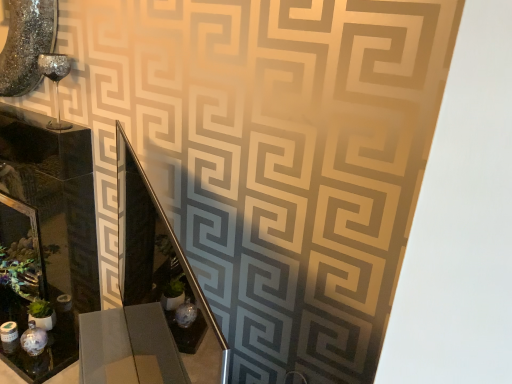
At what (x,y) coordinates should I click in order to perform the action: click on matte black glass box at left. Please return your answer as a coordinate pair (x, y). The width and height of the screenshot is (512, 384). Looking at the image, I should click on (47, 234).

Where is `matte glass picture frame at lower left`? The height and width of the screenshot is (384, 512). matte glass picture frame at lower left is located at coordinates (32, 236).

Is metallic silver vanity at center taller than matte glass picture frame at lower left?

Indeed, metallic silver vanity at center has a greater height compared to matte glass picture frame at lower left.

From the picture: Can you confirm if metallic silver vanity at center is positioned to the right of matte glass picture frame at lower left?

Yes, metallic silver vanity at center is to the right of matte glass picture frame at lower left.

Can you confirm if metallic silver vanity at center is wider than matte glass picture frame at lower left?

Incorrect, the width of metallic silver vanity at center does not surpass that of matte glass picture frame at lower left.

From the picture: Is metallic silver vanity at center completely or partially outside of matte glass picture frame at lower left?

Yes, metallic silver vanity at center is not within matte glass picture frame at lower left.

Would you say metallic silver vanity at center is part of matte black glass box at left's contents?

That's incorrect, metallic silver vanity at center is not inside matte black glass box at left.

Is matte black glass box at left wider or thinner than metallic silver vanity at center?

Considering their sizes, matte black glass box at left looks broader than metallic silver vanity at center.

Between point (47, 216) and point (126, 248), which one is positioned in front?

The point (126, 248) is in front.

Is matte black glass box at left aimed at metallic silver vanity at center?

No.

Between matte glass picture frame at lower left and metallic silver vanity at center, which one has less height?

matte glass picture frame at lower left is shorter.

Is matte glass picture frame at lower left looking in the opposite direction of metallic silver vanity at center?

No.

Where is `vanity that is in front of the matte glass picture frame at lower left`? Image resolution: width=512 pixels, height=384 pixels. vanity that is in front of the matte glass picture frame at lower left is located at coordinates (149, 299).

Is matte black glass box at left in front of or behind matte glass picture frame at lower left in the image?

matte black glass box at left is in front of matte glass picture frame at lower left.

Can we say matte black glass box at left lies outside matte glass picture frame at lower left?

That's correct, matte black glass box at left is outside of matte glass picture frame at lower left.

In the scene shown: Considering the relative sizes of matte black glass box at left and matte glass picture frame at lower left in the image provided, is matte black glass box at left wider than matte glass picture frame at lower left?

Correct, the width of matte black glass box at left exceeds that of matte glass picture frame at lower left.

Considering the points (33, 275) and (12, 200), which point is in front, point (33, 275) or point (12, 200)?

The point (12, 200) is closer to the camera.

In the image, is metallic silver vanity at center on the left side or the right side of matte black glass box at left?

Clearly, metallic silver vanity at center is on the right of matte black glass box at left in the image.

Which of these two, metallic silver vanity at center or matte black glass box at left, is bigger?

matte black glass box at left.

Is metallic silver vanity at center further to camera compared to matte black glass box at left?

No, metallic silver vanity at center is in front of matte black glass box at left.

Is metallic silver vanity at center positioned far away from matte black glass box at left?

No, there isn't a large distance between metallic silver vanity at center and matte black glass box at left.

Is matte glass picture frame at lower left to the left or to the right of matte black glass box at left in the image?

Based on their positions, matte glass picture frame at lower left is located to the left of matte black glass box at left.

How distant is matte glass picture frame at lower left from matte black glass box at left?

matte glass picture frame at lower left is 9.71 inches from matte black glass box at left.

From a real-world perspective, is matte glass picture frame at lower left located higher than matte black glass box at left?

Incorrect, from a real-world perspective, matte glass picture frame at lower left is lower than matte black glass box at left.

Where is `picture frame located underneath the metallic silver vanity at center (from a real-world perspective)`? picture frame located underneath the metallic silver vanity at center (from a real-world perspective) is located at coordinates (32, 236).

Identify the location of vanity above the matte black glass box at left (from a real-world perspective). This screenshot has height=384, width=512. (149, 299).

When comparing their distances from matte glass picture frame at lower left, does matte black glass box at left or metallic silver vanity at center seem closer?

matte black glass box at left is positioned closer to the anchor matte glass picture frame at lower left.

From the image, which object appears to be farther from matte black glass box at left, matte glass picture frame at lower left or metallic silver vanity at center?

metallic silver vanity at center.

From the image, which object appears to be farther from matte black glass box at left, metallic silver vanity at center or matte glass picture frame at lower left?

metallic silver vanity at center is positioned further to the anchor matte black glass box at left.

From the image, which object appears to be nearer to matte glass picture frame at lower left, metallic silver vanity at center or matte black glass box at left?

matte black glass box at left is closer to matte glass picture frame at lower left.

Which object lies nearer to the anchor point metallic silver vanity at center, matte black glass box at left or matte glass picture frame at lower left?

matte black glass box at left.

Looking at the image, which one is located further to metallic silver vanity at center, matte glass picture frame at lower left or matte black glass box at left?

matte glass picture frame at lower left is positioned further to the anchor metallic silver vanity at center.

The image size is (512, 384). I want to click on glass box between metallic silver vanity at center and matte glass picture frame at lower left along the z-axis, so click(x=47, y=234).